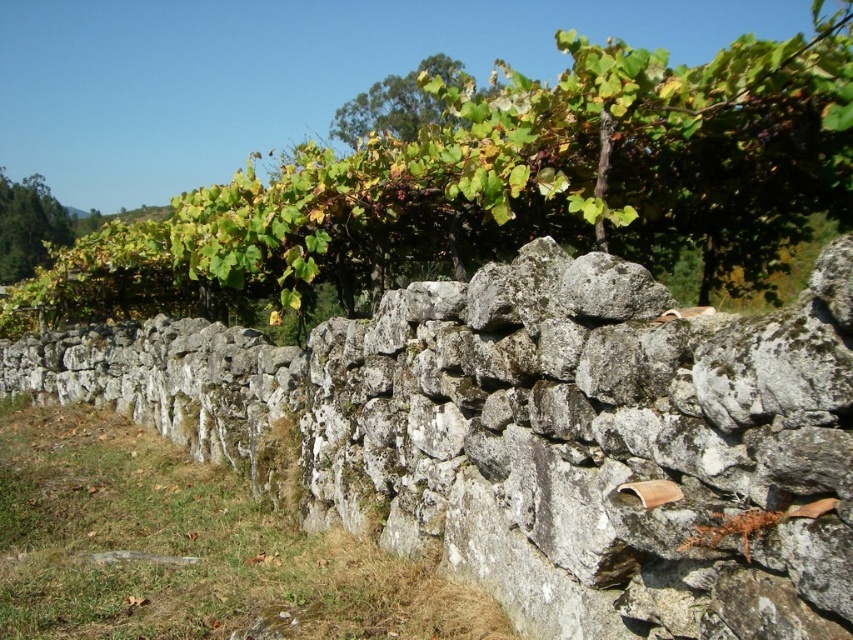
Question: Does gray rough stone wall at center appear on the left side of green leafy vine at upper center?

Choices:
 (A) no
 (B) yes

Answer: (A)

Question: Among these points, which one is nearest to the camera?

Choices:
 (A) (386, 353)
 (B) (776, 179)

Answer: (B)

Question: Is gray rough stone wall at center smaller than green leafy vine at upper center?

Choices:
 (A) no
 (B) yes

Answer: (B)

Question: Which of the following is the farthest from the observer?

Choices:
 (A) green leafy vine at upper center
 (B) gray rough stone wall at center

Answer: (A)

Question: Does gray rough stone wall at center appear on the right side of green leafy vine at upper center?

Choices:
 (A) no
 (B) yes

Answer: (B)